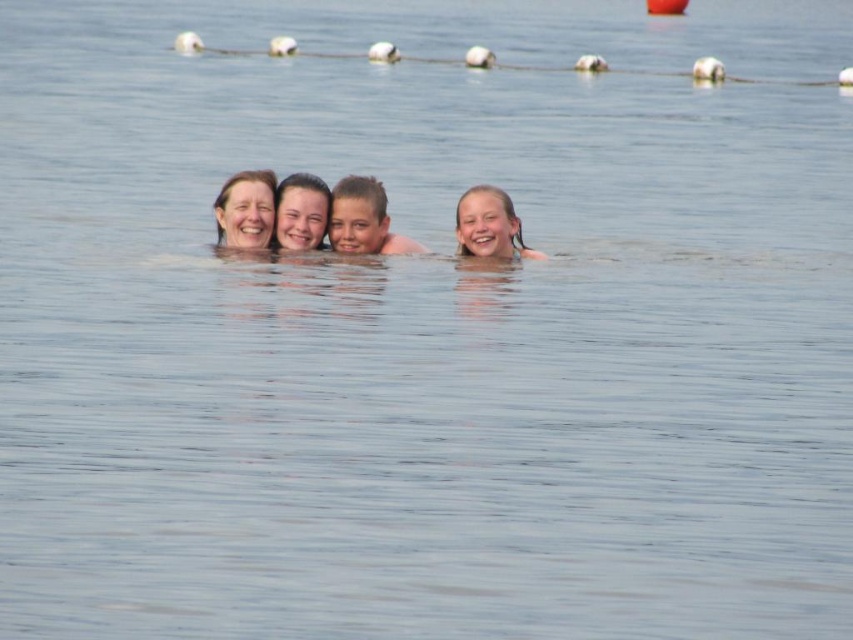
You are a photographer taking a picture of the scene. You notice two points in the image at coordinates point (380,240) and point (280,202). Which point is closer to the camera?

Point (380,240) is further to the viewer than point (280,202), so the point closer to the camera is point (280,202).